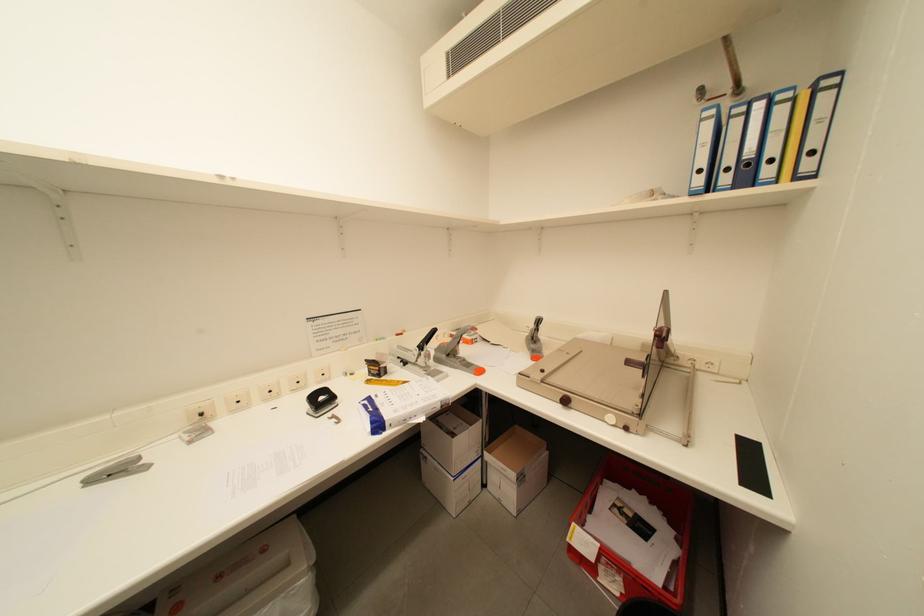
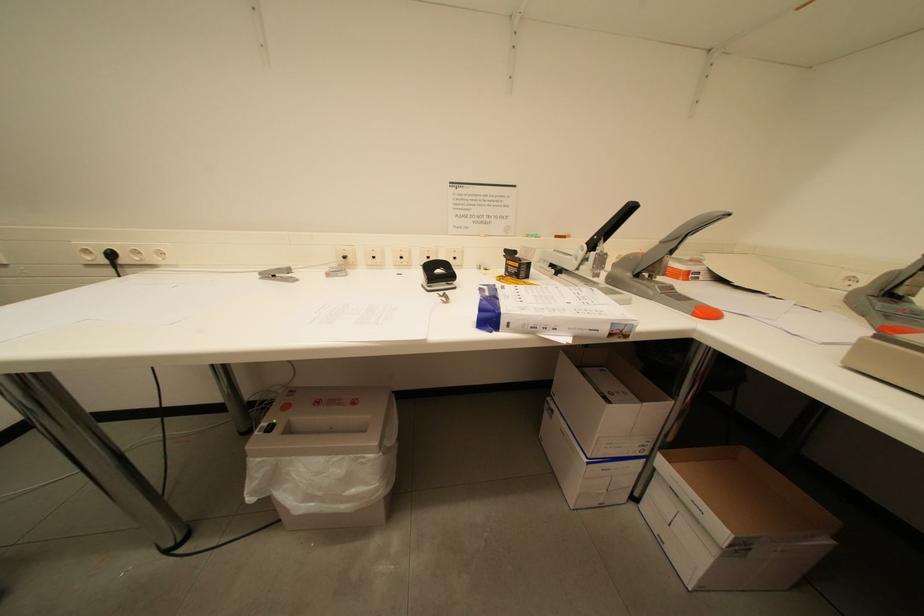
Question: The camera is either moving clockwise (left) or counter-clockwise (right) around the object. The first image is from the beginning of the video and the second image is from the end. Is the camera moving left or right when shooting the video?

Choices:
 (A) Left
 (B) Right

Answer: (B)